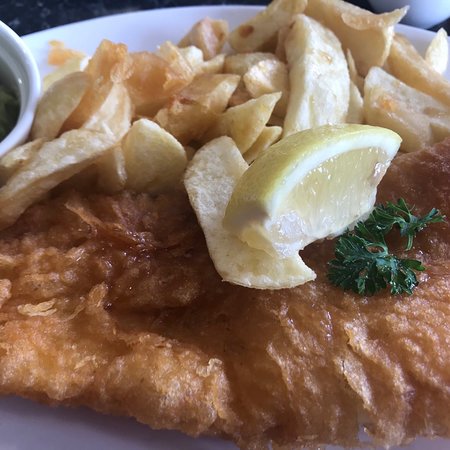
Where is `plate`? plate is located at coordinates (57, 427).